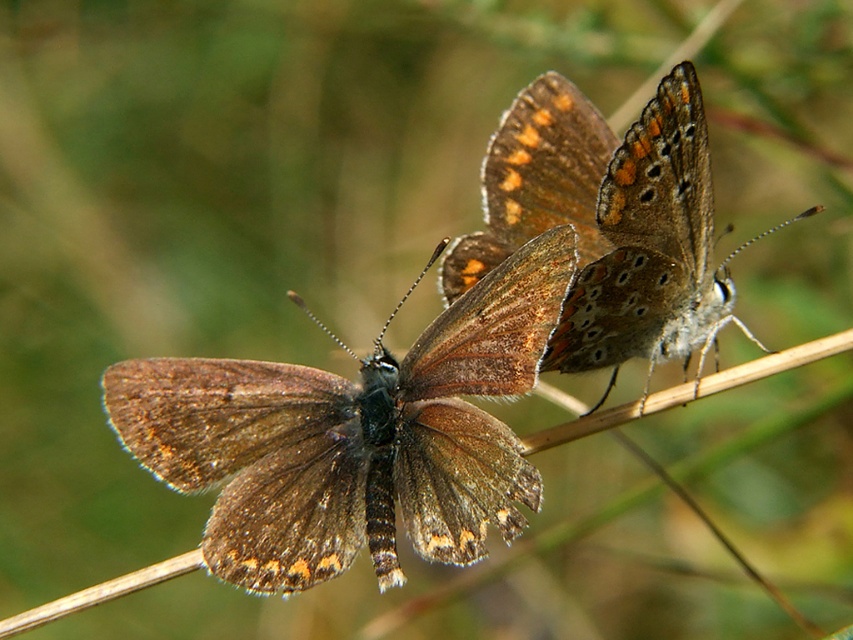
Can you confirm if brown fuzzy butterfly at center is thinner than brown textured wings at center?

No.

Is point (372, 371) positioned before point (561, 362)?

Yes.

Locate an element on the screen. brown fuzzy butterfly at center is located at coordinates (354, 436).